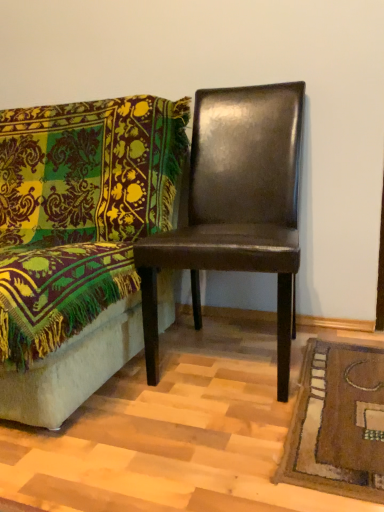
Question: Considering the positions of point (291, 209) and point (134, 348), is point (291, 209) closer or farther from the camera than point (134, 348)?

Choices:
 (A) closer
 (B) farther

Answer: (B)

Question: Considering the positions of shiny brown leather chair at center, placed as the 1th chair when sorted from right to left, and shiny brown leather chair at right, which is the second chair in right-to-left order, in the image, is shiny brown leather chair at center, placed as the 1th chair when sorted from right to left, wider or thinner than shiny brown leather chair at right, which is the second chair in right-to-left order,?

Choices:
 (A) wide
 (B) thin

Answer: (B)

Question: In the image, is shiny brown leather chair at center, placed as the 1th chair when sorted from right to left, positioned in front of or behind shiny brown leather chair at right, which is the 1th chair in left-to-right order?

Choices:
 (A) front
 (B) behind

Answer: (B)

Question: Is point (62, 409) positioned closer to the camera than point (246, 214)?

Choices:
 (A) farther
 (B) closer

Answer: (B)

Question: From the image's perspective, is shiny brown leather chair at right, which is the 1th chair in left-to-right order, above or below shiny brown leather chair at center, placed as the 1th chair when sorted from right to left?

Choices:
 (A) above
 (B) below

Answer: (B)

Question: Is shiny brown leather chair at right, which is the 1th chair in left-to-right order, inside or outside of shiny brown leather chair at center, placed as the 1th chair when sorted from right to left?

Choices:
 (A) outside
 (B) inside

Answer: (A)

Question: Is shiny brown leather chair at right, which is the second chair in right-to-left order, bigger or smaller than shiny brown leather chair at center, which is the second chair in left-to-right order?

Choices:
 (A) big
 (B) small

Answer: (A)